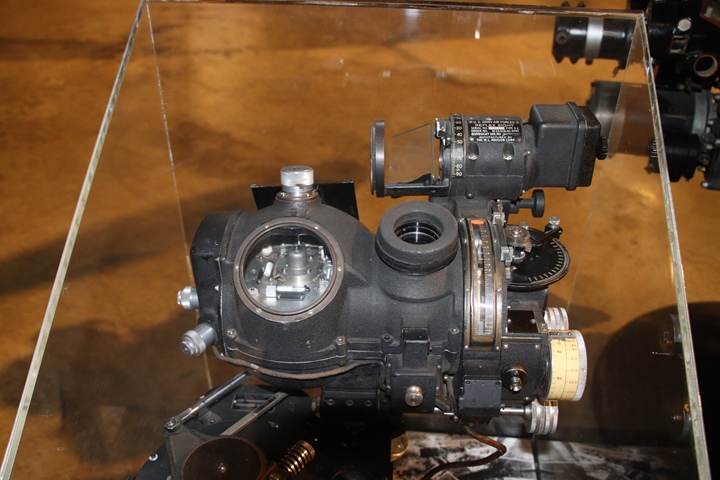
Locate an element on the screen. clear floor behind glass case is located at coordinates (338, 103).